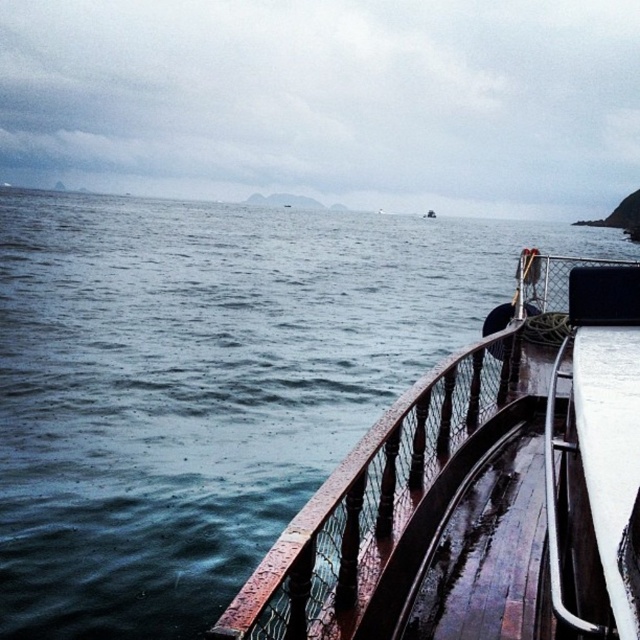
How much distance is there between dark blue water at left and rustic wood rail at lower right?

32.03 meters

Can you confirm if dark blue water at left is taller than rustic wood rail at lower right?

Correct, dark blue water at left is much taller as rustic wood rail at lower right.

This screenshot has width=640, height=640. I want to click on dark blue water at left, so click(x=204, y=330).